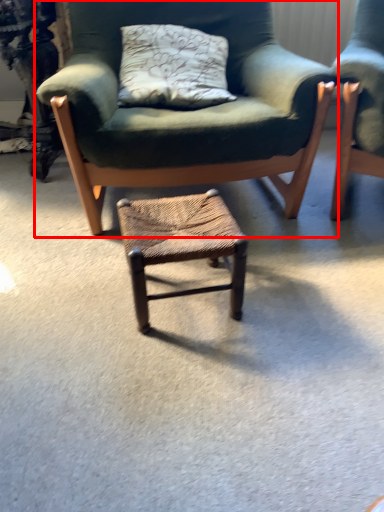
Question: From the image's perspective, considering the relative positions of chair (annotated by the red box) and stool in the image provided, where is chair (annotated by the red box) located with respect to the staircase?

Choices:
 (A) above
 (B) below

Answer: (A)